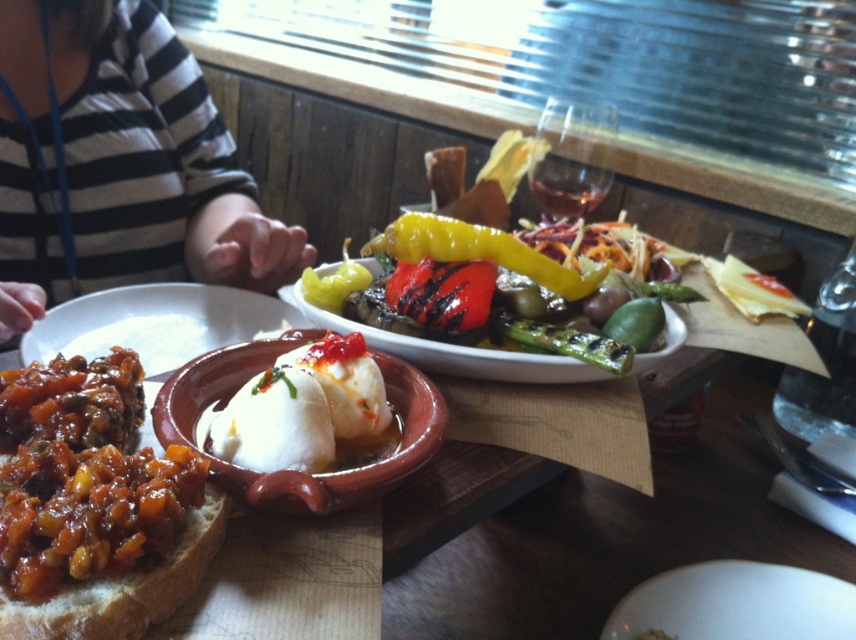
Question: Which of the following is the closest to the observer?

Choices:
 (A) white creamy dollops at center
 (B) glossy yellow pepper at center
 (C) brown crusty bread at lower left

Answer: (C)

Question: Which object appears closest to the camera in this image?

Choices:
 (A) shiny brown bread with chili topping at lower left
 (B) white creamy dollops at center
 (C) brown crusty bread at lower left

Answer: (C)

Question: Which point is closer to the camera?

Choices:
 (A) striped fabric at upper left
 (B) glossy yellow pepper at center
 (C) brown crusty bread at lower left

Answer: (C)

Question: Does shiny brown bread with chili topping at lower left lie behind glossy yellow pepper at center?

Choices:
 (A) yes
 (B) no

Answer: (B)

Question: Can you confirm if striped fabric at upper left is wider than white creamy dollops at center?

Choices:
 (A) no
 (B) yes

Answer: (B)

Question: Does striped fabric at upper left have a larger size compared to shiny brown bread with chili topping at lower left?

Choices:
 (A) yes
 (B) no

Answer: (A)